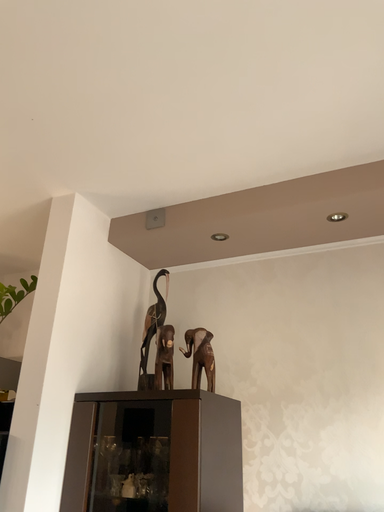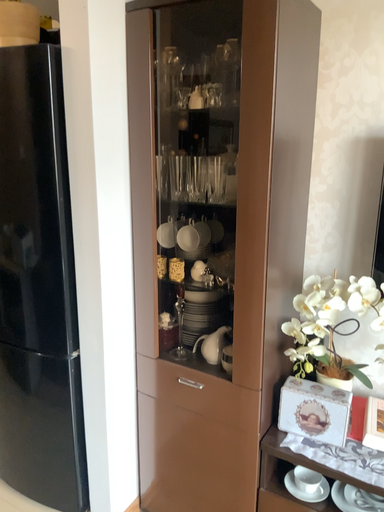
Question: How did the camera likely rotate when shooting the video?

Choices:
 (A) rotated upward
 (B) rotated downward

Answer: (B)